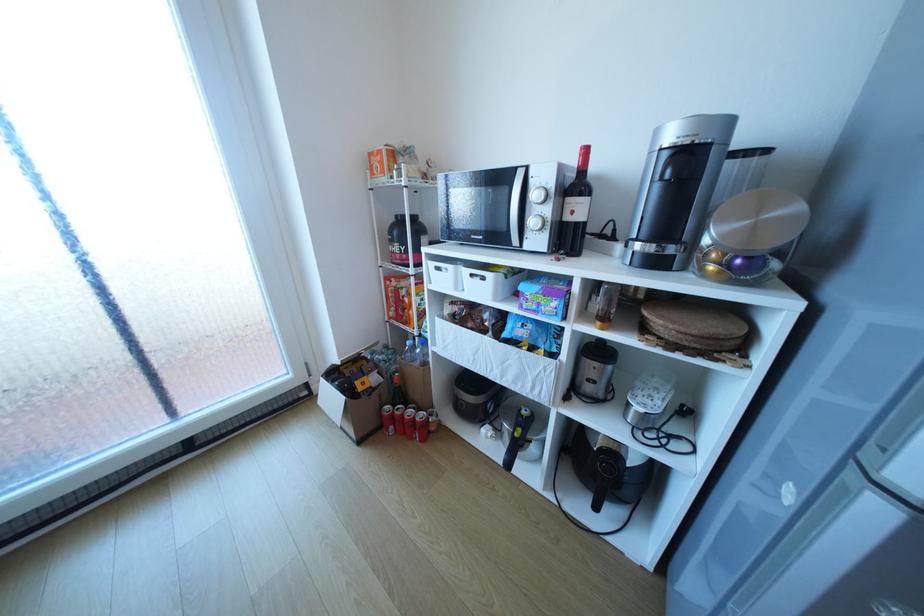
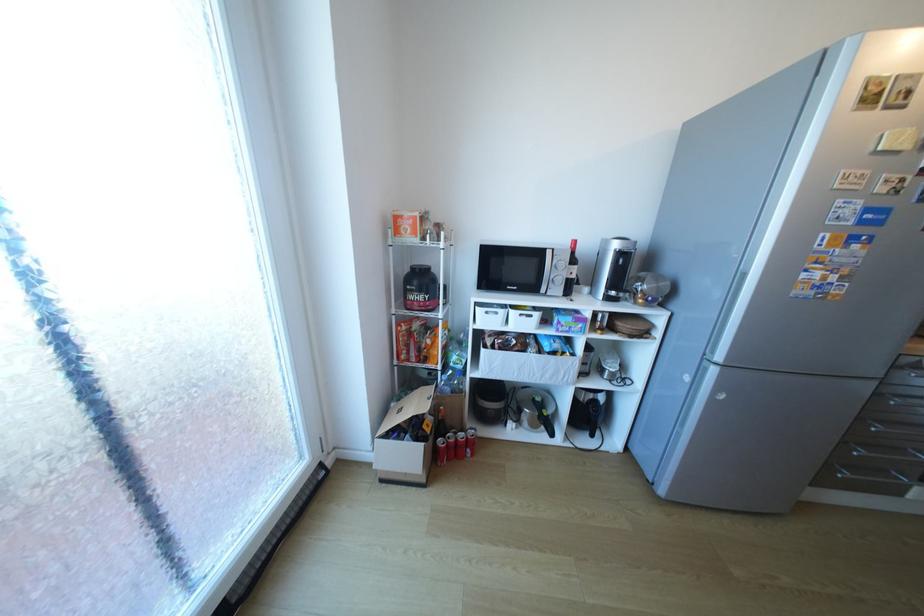
In the second image, find the point that corresponds to pixel 342 382 in the first image.

(407, 437)